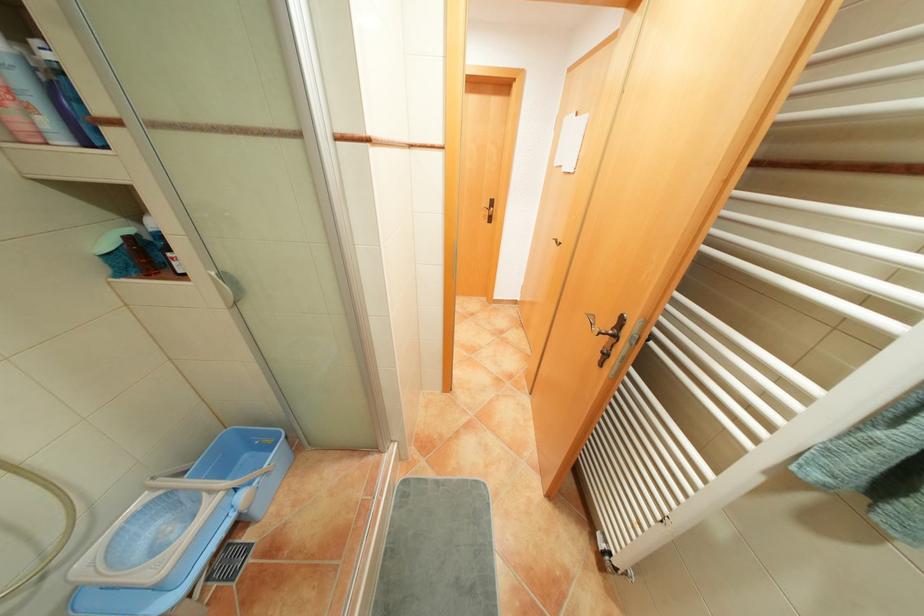
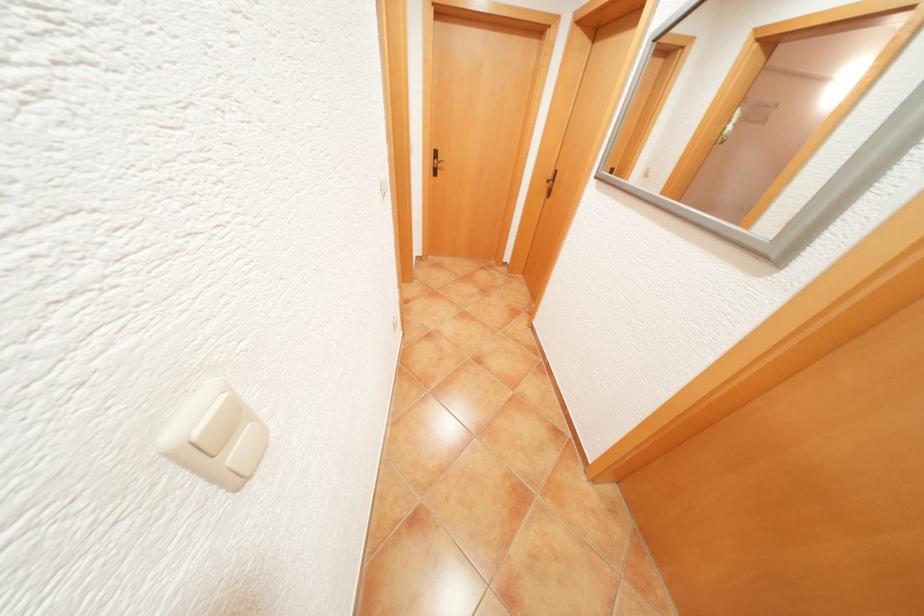
Question: I am providing you with two images of the same scene from different viewpoints. Please identify which objects are invisible in image2.

Choices:
 (A) radiator valve knob
 (B) black door handle
 (C) blue waste basket
 (D) light switch rocker

Answer: (A)